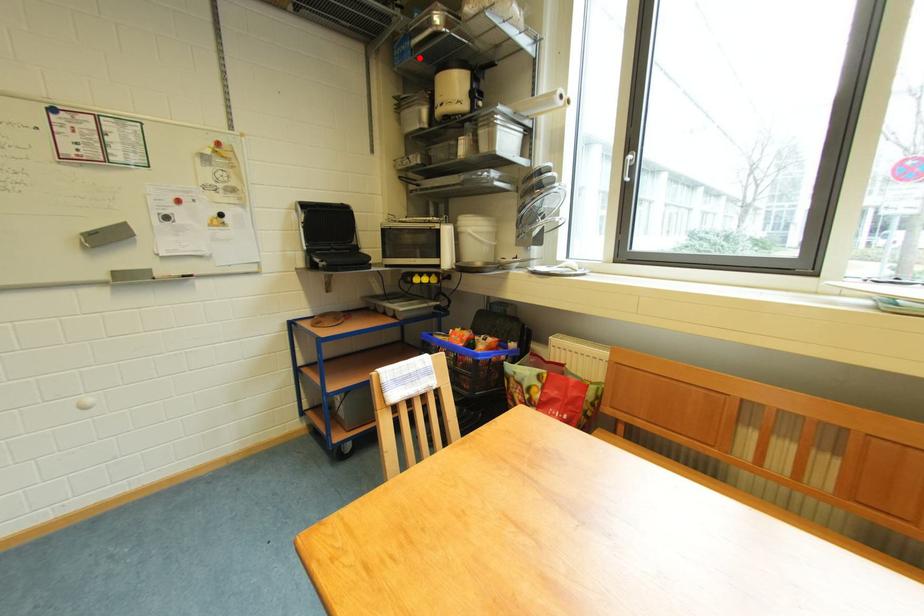
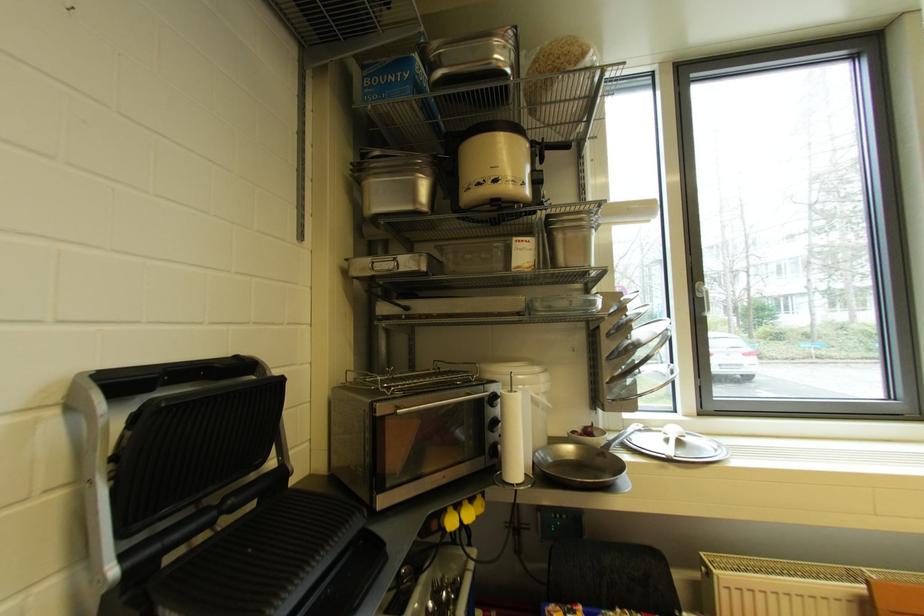
Locate, in the second image, the point that corresponds to the highlighted location in the first image.

(420, 97)